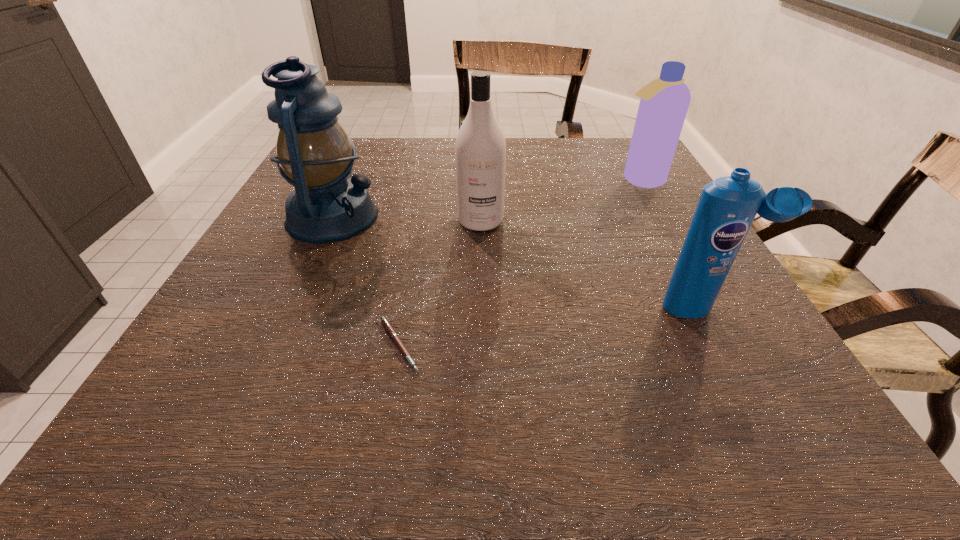
Where is `free location located on the back of the nearest shampoo`? This screenshot has width=960, height=540. free location located on the back of the nearest shampoo is located at coordinates (657, 219).

Find the location of a particular element. Image resolution: width=960 pixels, height=540 pixels. vacant region located 0.140m at the nib of the pen is located at coordinates (514, 345).

Identify the location of object that is at the far edge. The image size is (960, 540). (664, 102).

The height and width of the screenshot is (540, 960). Identify the location of object that is at the left edge. (314, 153).

Where is `object that is at the far right corner`? The height and width of the screenshot is (540, 960). object that is at the far right corner is located at coordinates pos(664,102).

At what (x,y) coordinates should I click in order to perform the action: click on vacant space at the far edge of the desktop. Please return your answer as a coordinate pair (x, y). The width and height of the screenshot is (960, 540). Looking at the image, I should click on (453, 143).

In the image, there is a desktop. In order to click on vacant space at the near edge in this screenshot , I will do `click(597, 393)`.

The height and width of the screenshot is (540, 960). In order to click on vacant space at the left edge in this screenshot , I will do `click(282, 208)`.

Image resolution: width=960 pixels, height=540 pixels. In the image, there is a desktop. In order to click on vacant space at the right edge in this screenshot , I will do `click(648, 190)`.

The image size is (960, 540). In order to click on vacant space at the far right corner in this screenshot , I will do `click(592, 154)`.